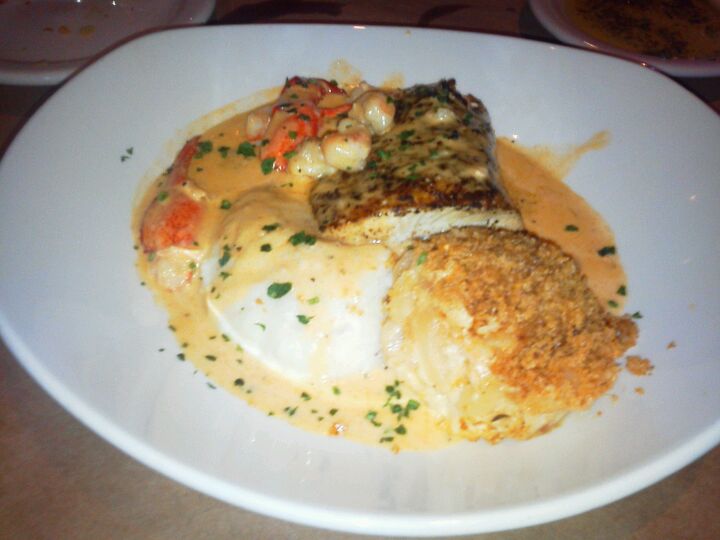
Locate an element on the screen. Image resolution: width=720 pixels, height=540 pixels. sauce on plate is located at coordinates (552, 200), (222, 124), (216, 171), (202, 323).